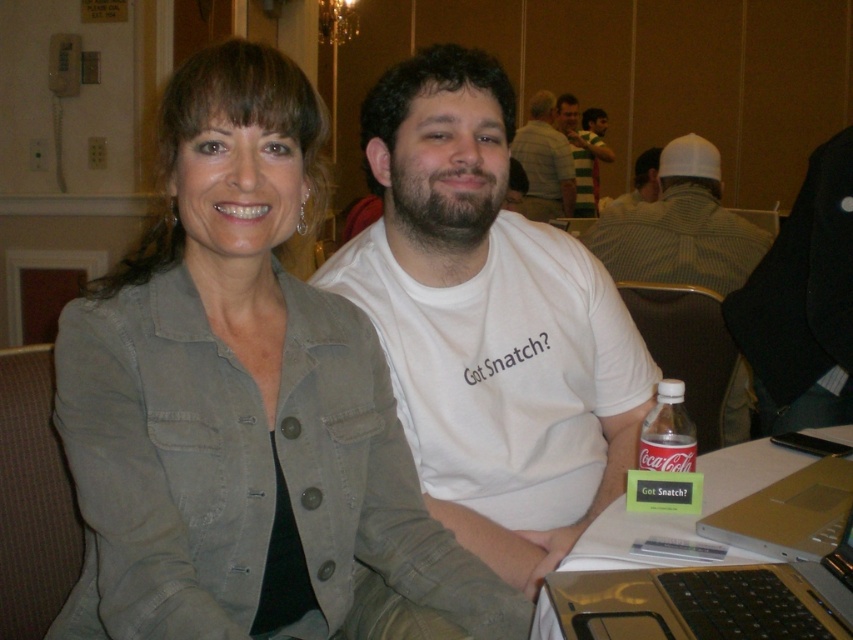
Question: Does striped jersey at upper center have a lesser width compared to white cotton shirt at upper center?

Choices:
 (A) no
 (B) yes

Answer: (B)

Question: Which point is farther to the camera?

Choices:
 (A) white cotton t-shirt at center
 (B) white cotton shirt at upper center
 (C) silver metallic laptop at lower right

Answer: (B)

Question: Considering the real-world distances, which object is farthest from the clear plastic bottle at lower right?

Choices:
 (A) denim jacket at center
 (B) silver metallic laptop at lower right
 (C) striped jersey at upper center

Answer: (C)

Question: Is clear plastic bottle at lower right thinner than striped jersey at upper center?

Choices:
 (A) no
 (B) yes

Answer: (B)

Question: Which of these objects is positioned closest to the striped jersey at upper center?

Choices:
 (A) silver metallic laptop at lower right
 (B) clear plastic bottle at lower right
 (C) striped cotton shirt at center
 (D) white checkered shirt at center

Answer: (C)

Question: Is white cotton t-shirt at center positioned behind white checkered shirt at center?

Choices:
 (A) no
 (B) yes

Answer: (A)